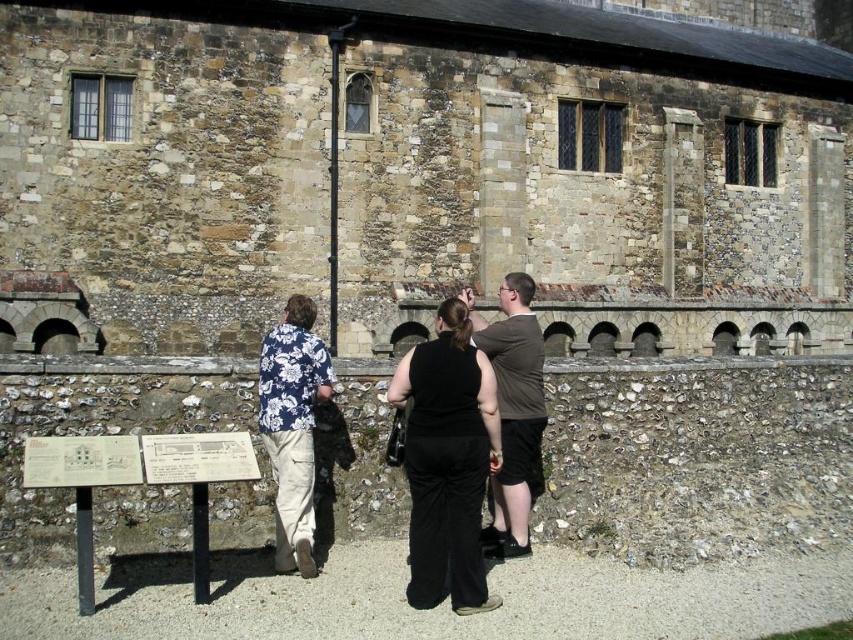
Is black matte pants at center to the right of brown cotton t-shirt at center from the viewer's perspective?

No, black matte pants at center is not to the right of brown cotton t-shirt at center.

Does black matte pants at center come behind brown cotton t-shirt at center?

No, it is not.

Which is in front, point (467, 456) or point (526, 333)?

Positioned in front is point (467, 456).

Identify the location of black matte pants at center. 447,461.

Between stone wall at center and white paper sign at center, which one is positioned lower?

Positioned lower is white paper sign at center.

Can you confirm if stone wall at center is positioned above white paper sign at center?

Correct, stone wall at center is located above white paper sign at center.

In order to click on stone wall at center in this screenshot , I will do `click(422, 172)`.

Does point (466, 104) lie behind point (541, 385)?

Yes.

I want to click on stone wall at center, so click(422, 172).

Image resolution: width=853 pixels, height=640 pixels. Identify the location of stone wall at center. (422, 172).